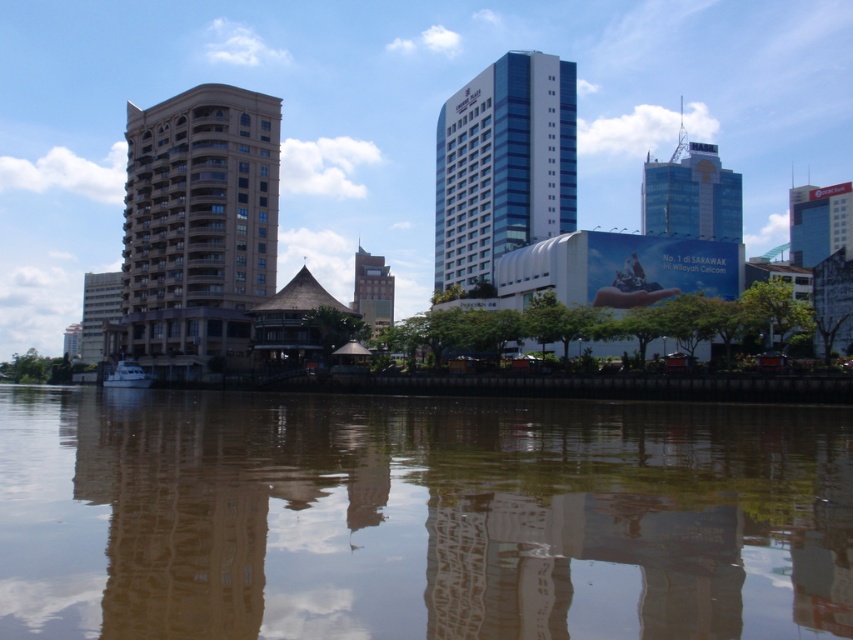
You are standing at the riverside and notice two points in the scene. The first point is located at coordinates point (160, 186) and the second at point (387, 292). Which of these points is nearer to your current position?

Point (160, 186) is closer to the camera than point (387, 292), so the first point is nearer to your current position.

You are a city planner reviewing the urban riverside scene. You need to determine which structure occupies a larger footprint in the image. Based on the beige stone building at center and the green glass tower at center, which one is bigger?

The green glass tower at center is larger than the beige stone building at center, so the green glass tower at center has a bigger footprint.

You are a tourist standing on the riverside walkway and want to take a photo that includes both the blue glassy building at center and the white matte boat at lower left. Based on their positions, will the boat appear smaller in the photo compared to the building?

The blue glassy building at center is above the white matte boat at lower left, so in the photo, the boat will appear smaller than the building because it is positioned further away from the camera.